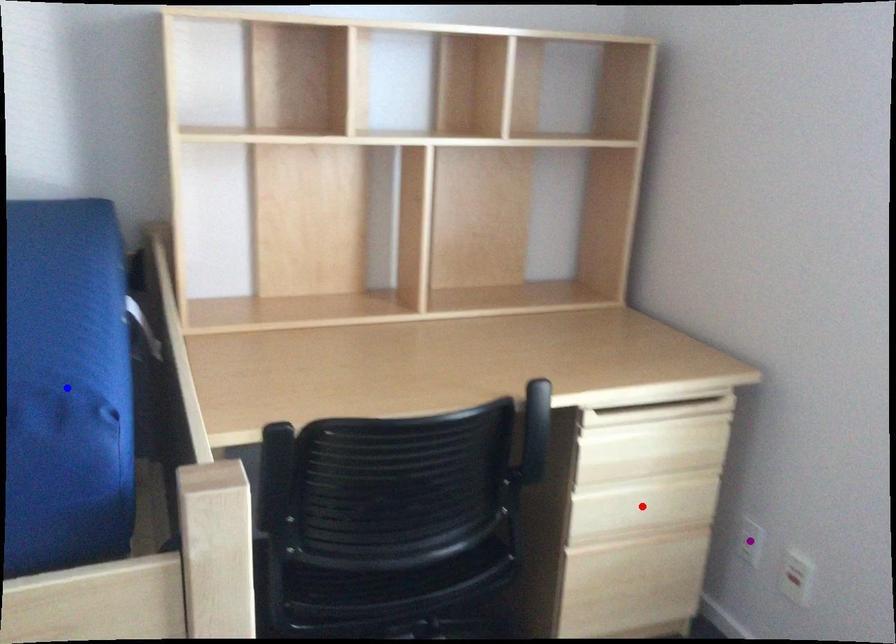
Order these from nearest to farthest:
- blue point
- purple point
- red point

blue point
red point
purple point